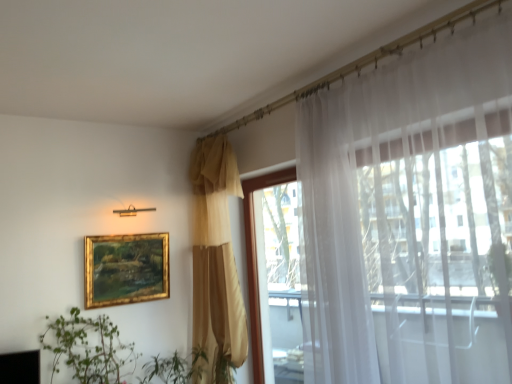
Question: From the image's perspective, is transparent glass window at upper right under white sheer curtain at right, which ranks as the first curtain in right-to-left order?

Choices:
 (A) no
 (B) yes

Answer: (B)

Question: From a real-world perspective, is transparent glass window at upper right below white sheer curtain at right, the 2th curtain positioned from the left?

Choices:
 (A) no
 (B) yes

Answer: (B)

Question: Does transparent glass window at upper right have a greater height compared to white sheer curtain at right, the 1th curtain from the front?

Choices:
 (A) yes
 (B) no

Answer: (B)

Question: Is transparent glass window at upper right not within white sheer curtain at right, the 1th curtain from the front?

Choices:
 (A) no
 (B) yes

Answer: (B)

Question: Could white sheer curtain at right, which ranks as the first curtain in right-to-left order, be considered to be inside transparent glass window at upper right?

Choices:
 (A) yes
 (B) no

Answer: (B)

Question: Is transparent glass window at upper right at the right side of white sheer curtain at right, the 2th curtain positioned from the left?

Choices:
 (A) no
 (B) yes

Answer: (A)

Question: Is transparent glass window at upper right surrounding gold-framed painting at upper left?

Choices:
 (A) no
 (B) yes

Answer: (A)

Question: From a real-world perspective, is transparent glass window at upper right on top of gold-framed painting at upper left?

Choices:
 (A) yes
 (B) no

Answer: (B)

Question: Is transparent glass window at upper right looking in the opposite direction of gold-framed painting at upper left?

Choices:
 (A) yes
 (B) no

Answer: (B)

Question: Is transparent glass window at upper right outside of gold-framed painting at upper left?

Choices:
 (A) yes
 (B) no

Answer: (A)

Question: Can you confirm if transparent glass window at upper right is bigger than gold-framed painting at upper left?

Choices:
 (A) yes
 (B) no

Answer: (A)

Question: Is transparent glass window at upper right at the right side of gold-framed painting at upper left?

Choices:
 (A) yes
 (B) no

Answer: (A)

Question: Is matte gold curtain at center, which is the 2th curtain from front to back, located outside gold-framed painting at upper left?

Choices:
 (A) yes
 (B) no

Answer: (A)